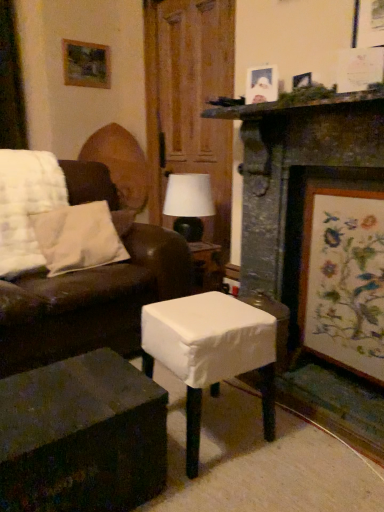
Question: Is matte white picture frame at upper right, which is counted as the second picture frame, starting from the right, oriented towards dark wood table at lower left, marked as the first table in a left-to-right arrangement?

Choices:
 (A) yes
 (B) no

Answer: (B)

Question: From the image's perspective, is matte white picture frame at upper right, placed as the 2th picture frame when sorted from left to right, below dark wood table at lower left, positioned as the 2th table in right-to-left order?

Choices:
 (A) no
 (B) yes

Answer: (A)

Question: Considering the relative sizes of matte white picture frame at upper right, the 2th picture frame when ordered from front to back, and dark wood table at lower left, positioned as the 2th table in right-to-left order, in the image provided, is matte white picture frame at upper right, the 2th picture frame when ordered from front to back, shorter than dark wood table at lower left, positioned as the 2th table in right-to-left order,?

Choices:
 (A) yes
 (B) no

Answer: (A)

Question: Is matte white picture frame at upper right, acting as the 2th picture frame starting from the top, wider than dark wood table at lower left, marked as the first table in a left-to-right arrangement?

Choices:
 (A) yes
 (B) no

Answer: (B)

Question: Is matte white picture frame at upper right, placed as the 2th picture frame when sorted from left to right, further to camera compared to dark wood table at lower left, marked as the first table in a left-to-right arrangement?

Choices:
 (A) no
 (B) yes

Answer: (B)

Question: From the image's perspective, is matte white picture frame at upper right, acting as the 2th picture frame starting from the top, above or below wooden door at center?

Choices:
 (A) below
 (B) above

Answer: (A)

Question: Is matte white picture frame at upper right, the second picture frame when ordered from back to front, in front of or behind wooden door at center in the image?

Choices:
 (A) behind
 (B) front

Answer: (B)

Question: From a real-world perspective, is matte white picture frame at upper right, which is counted as the 2th picture frame, starting from the bottom, physically located above or below wooden door at center?

Choices:
 (A) below
 (B) above

Answer: (B)

Question: Is point (274, 87) closer or farther from the camera than point (223, 145)?

Choices:
 (A) closer
 (B) farther

Answer: (A)

Question: From a real-world perspective, is dark wood table at lower left, positioned as the 2th table in right-to-left order, above or below white fabric-covered stool at center, which ranks as the first table in right-to-left order?

Choices:
 (A) below
 (B) above

Answer: (A)

Question: Is dark wood table at lower left, positioned as the 2th table in right-to-left order, wider or thinner than white fabric-covered stool at center, which ranks as the first table in right-to-left order?

Choices:
 (A) wide
 (B) thin

Answer: (B)

Question: In terms of height, does dark wood table at lower left, marked as the first table in a left-to-right arrangement, look taller or shorter compared to white fabric-covered stool at center, which ranks as the first table in right-to-left order?

Choices:
 (A) tall
 (B) short

Answer: (B)

Question: Does point (130, 422) appear closer or farther from the camera than point (264, 351)?

Choices:
 (A) closer
 (B) farther

Answer: (A)

Question: Is point (168, 153) closer or farther from the camera than point (91, 436)?

Choices:
 (A) closer
 (B) farther

Answer: (B)

Question: In terms of size, does wooden door at center appear bigger or smaller than dark wood table at lower left, positioned as the 2th table in right-to-left order?

Choices:
 (A) big
 (B) small

Answer: (A)